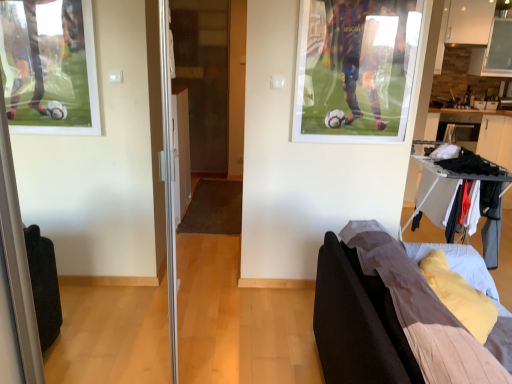
Describe the element at coordinates (203, 77) in the screenshot. I see `transparent glass screen door at center` at that location.

Identify the location of transparent glass screen door at center. (203, 77).

What do you see at coordinates (390, 318) in the screenshot? This screenshot has width=512, height=384. I see `brown fabric couch at lower right` at bounding box center [390, 318].

What is the approximate width of brown fabric couch at lower right?

38.44 inches.

Where is `brown fabric couch at lower right`? brown fabric couch at lower right is located at coordinates tap(390, 318).

Measure the distance between point (x=382, y=247) and camera.

Point (x=382, y=247) is 5.82 feet away from camera.

Locate an element on the screen. The image size is (512, 384). transparent glass screen door at center is located at coordinates (203, 77).

Between brown fabric couch at lower right and transparent glass screen door at center, which one appears on the right side from the viewer's perspective?

brown fabric couch at lower right.

Is brown fabric couch at lower right positioned behind transparent glass screen door at center?

No, it is not.

Does point (330, 262) come behind point (211, 6)?

That is False.

From the image's perspective, would you say brown fabric couch at lower right is shown under transparent glass screen door at center?

Correct, brown fabric couch at lower right appears lower than transparent glass screen door at center in the image.

From a real-world perspective, relative to transparent glass screen door at center, is brown fabric couch at lower right vertically above or below?

brown fabric couch at lower right is below transparent glass screen door at center.

Between brown fabric couch at lower right and transparent glass screen door at center, which one has smaller width?

transparent glass screen door at center.

Is brown fabric couch at lower right taller than transparent glass screen door at center?

Incorrect, the height of brown fabric couch at lower right is not larger of that of transparent glass screen door at center.

Considering the sizes of objects brown fabric couch at lower right and transparent glass screen door at center in the image provided, who is bigger, brown fabric couch at lower right or transparent glass screen door at center?

With larger size is brown fabric couch at lower right.

Would you say brown fabric couch at lower right is outside transparent glass screen door at center?

Yes, brown fabric couch at lower right is outside of transparent glass screen door at center.

Are brown fabric couch at lower right and transparent glass screen door at center far apart?

Yes, brown fabric couch at lower right and transparent glass screen door at center are quite far apart.

Could you tell me if brown fabric couch at lower right is turned towards transparent glass screen door at center?

No, brown fabric couch at lower right is not oriented towards transparent glass screen door at center.

This screenshot has height=384, width=512. What are the coordinates of `furniture below the transparent glass screen door at center (from the image's perspective)` in the screenshot? It's located at (390, 318).

Which is more to the left, transparent glass screen door at center or brown fabric couch at lower right?

Positioned to the left is transparent glass screen door at center.

In the image, is transparent glass screen door at center positioned in front of or behind brown fabric couch at lower right?

Clearly, transparent glass screen door at center is behind brown fabric couch at lower right.

Is point (210, 25) farther from viewer compared to point (426, 339)?

Yes, point (210, 25) is behind point (426, 339).

From the image's perspective, which object appears higher, transparent glass screen door at center or brown fabric couch at lower right?

From the image's view, transparent glass screen door at center is above.

Based on the photo, from a real-world perspective, is transparent glass screen door at center beneath brown fabric couch at lower right?

Incorrect, from a real-world perspective, transparent glass screen door at center is higher than brown fabric couch at lower right.

Can you confirm if transparent glass screen door at center is wider than brown fabric couch at lower right?

No.

Considering the relative sizes of transparent glass screen door at center and brown fabric couch at lower right in the image provided, is transparent glass screen door at center shorter than brown fabric couch at lower right?

No, transparent glass screen door at center is not shorter than brown fabric couch at lower right.

Is transparent glass screen door at center bigger than brown fabric couch at lower right?

Incorrect, transparent glass screen door at center is not larger than brown fabric couch at lower right.

Looking at this image, which is correct: transparent glass screen door at center is inside brown fabric couch at lower right, or outside of it?

transparent glass screen door at center is located beyond the bounds of brown fabric couch at lower right.

Does transparent glass screen door at center touch brown fabric couch at lower right?

transparent glass screen door at center and brown fabric couch at lower right are not in contact.

Is transparent glass screen door at center oriented away from brown fabric couch at lower right?

transparent glass screen door at center is not turned away from brown fabric couch at lower right.

Can you tell me how much transparent glass screen door at center and brown fabric couch at lower right differ in facing direction?

transparent glass screen door at center and brown fabric couch at lower right are facing 90.7 degrees away from each other.

In the image, there is a transparent glass screen door at center. Where is `furniture below it (from a real-world perspective)`? furniture below it (from a real-world perspective) is located at coordinates (390, 318).

The height and width of the screenshot is (384, 512). Find the location of `furniture in front of the transparent glass screen door at center`. furniture in front of the transparent glass screen door at center is located at coordinates (390, 318).

Identify the location of furniture below the transparent glass screen door at center (from a real-world perspective). The image size is (512, 384). (390, 318).